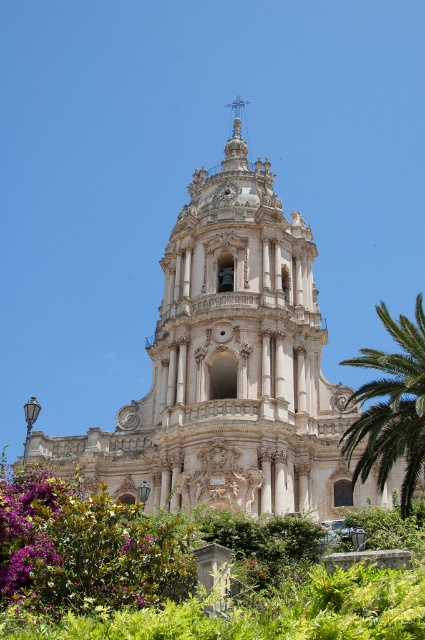
Does white stone church at center have a lesser width compared to green leafy palm at right?

No, white stone church at center is not thinner than green leafy palm at right.

Is point (235, 288) positioned after point (396, 376)?

Yes.

Which is behind, point (64, 445) or point (413, 326)?

The point (64, 445) is behind.

This screenshot has height=640, width=425. I want to click on white stone church at center, so click(231, 368).